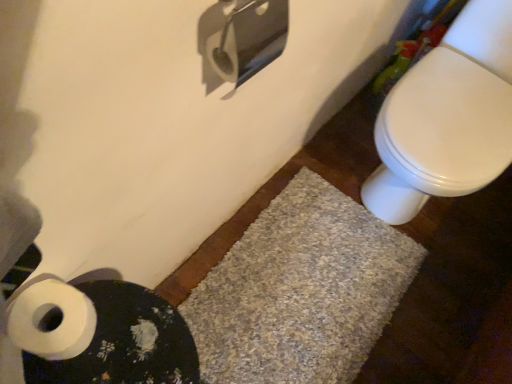
Question: Is white matte toilet paper at lower left closer to the viewer compared to white glossy toilet at right?

Choices:
 (A) no
 (B) yes

Answer: (B)

Question: Is white matte toilet paper at lower left not close to white glossy toilet at right?

Choices:
 (A) no
 (B) yes

Answer: (A)

Question: Is white matte toilet paper at lower left positioned beyond the bounds of white glossy toilet at right?

Choices:
 (A) yes
 (B) no

Answer: (A)

Question: From a real-world perspective, is white matte toilet paper at lower left under white glossy toilet at right?

Choices:
 (A) no
 (B) yes

Answer: (A)

Question: Is white matte toilet paper at lower left at the right side of white glossy toilet at right?

Choices:
 (A) no
 (B) yes

Answer: (A)

Question: Considering the relative sizes of white matte toilet paper at lower left and white glossy toilet at right in the image provided, is white matte toilet paper at lower left shorter than white glossy toilet at right?

Choices:
 (A) no
 (B) yes

Answer: (B)

Question: Considering the relative sizes of white textured bath mat at lower left, the 1th bath mat viewed from the front, and white matte toilet paper at lower left in the image provided, is white textured bath mat at lower left, the 1th bath mat viewed from the front, shorter than white matte toilet paper at lower left?

Choices:
 (A) yes
 (B) no

Answer: (B)

Question: Does white textured bath mat at lower left, the 1th bath mat viewed from the front, have a greater height compared to white matte toilet paper at lower left?

Choices:
 (A) yes
 (B) no

Answer: (A)

Question: From a real-world perspective, is white textured bath mat at lower left, which is the second bath mat in back-to-front order, physically above white matte toilet paper at lower left?

Choices:
 (A) yes
 (B) no

Answer: (B)

Question: Does white textured bath mat at lower left, the 1th bath mat viewed from the front, lie in front of white matte toilet paper at lower left?

Choices:
 (A) no
 (B) yes

Answer: (A)

Question: Is white textured bath mat at lower left, which is the second bath mat in back-to-front order, placed right next to white matte toilet paper at lower left?

Choices:
 (A) yes
 (B) no

Answer: (A)

Question: Can you confirm if white textured bath mat at lower left, the 1th bath mat viewed from the front, is wider than white matte toilet paper at lower left?

Choices:
 (A) yes
 (B) no

Answer: (A)

Question: Can you confirm if white textured bath mat at lower left, which is the second bath mat in back-to-front order, is smaller than white glossy toilet at right?

Choices:
 (A) yes
 (B) no

Answer: (A)